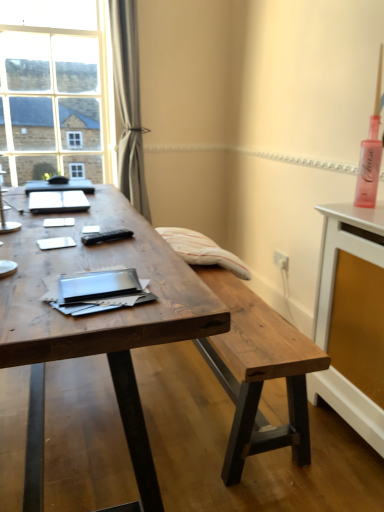
The image size is (384, 512). In order to click on free space above wooden desk at center (from a real-world perspective) in this screenshot , I will do `click(70, 242)`.